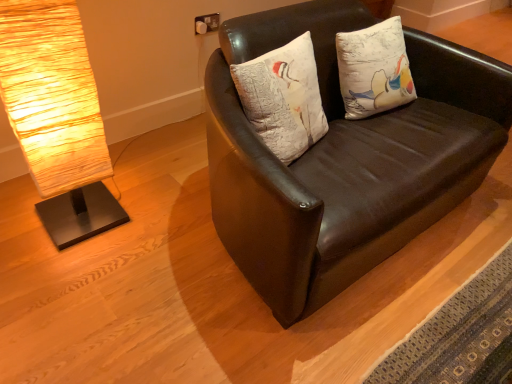
Where is `vacant space in front of rustic wood lamp at left`? vacant space in front of rustic wood lamp at left is located at coordinates (61, 269).